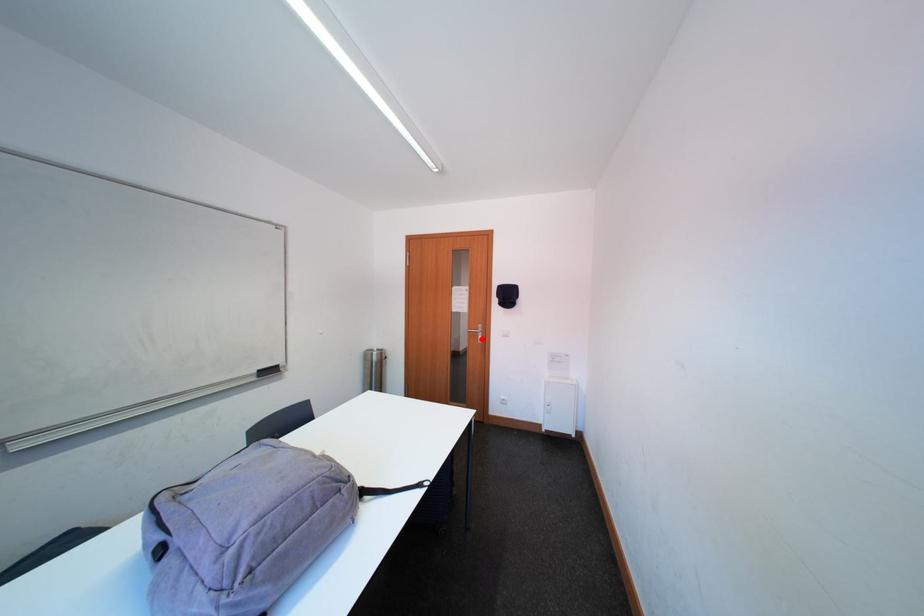
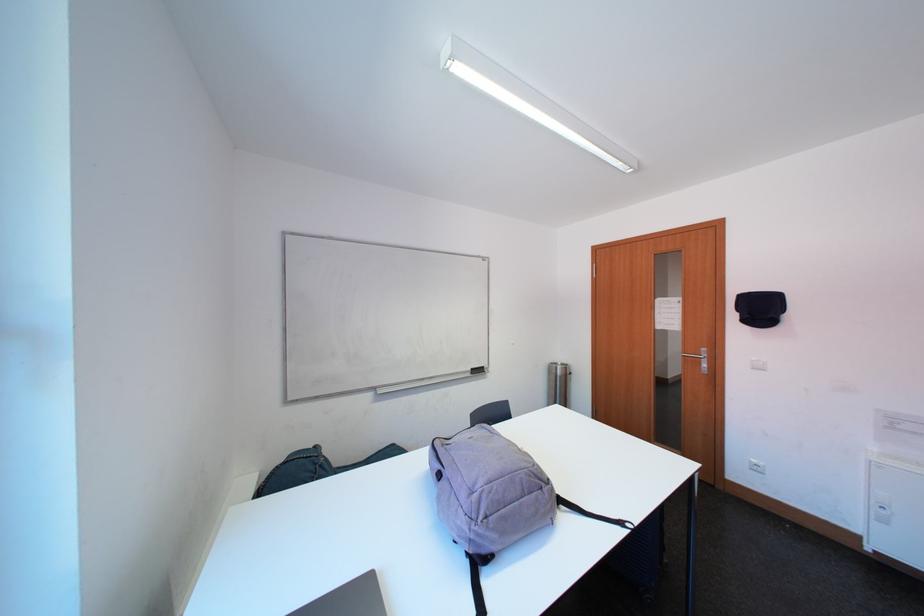
The point at the highlighted location is marked in the first image. Where is the corresponding point in the second image?

(699, 365)